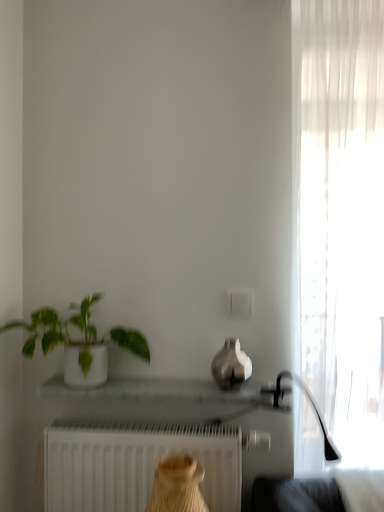
Locate an element on the screen. Image resolution: width=384 pixels, height=512 pixels. empty space that is ontop of white glossy tray at center (from a real-world perspective) is located at coordinates (152, 384).